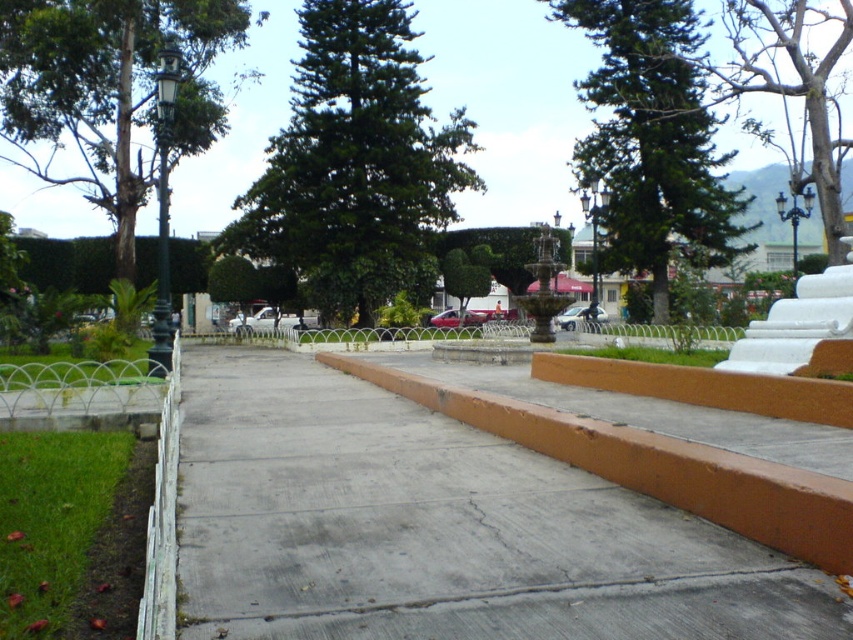
You are planning to plant a new tree in the park and need to choose between the green leafy tree at center and the green textured tree at left. Which tree has a narrower width, making it suitable for a space with limited horizontal room?

The green leafy tree at center has a narrower width than the green textured tree at left, making it suitable for spaces with limited horizontal room.

You are a park visitor standing on the paved pathway and want to walk to the gray concrete at center and the bare wood tree at upper right. Which object is located to the left when facing the scene?

The gray concrete at center is positioned on the left side of the bare wood tree at upper right, so when facing the scene, the gray concrete at center will be to the left of the bare wood tree at upper right.

You are a park visitor standing at the entrance facing the fountain. You notice the green textured tree at left and the bare wood tree at upper right. Which tree is positioned more to your left side?

The green textured tree at left is positioned more to the left side than the bare wood tree at upper right.